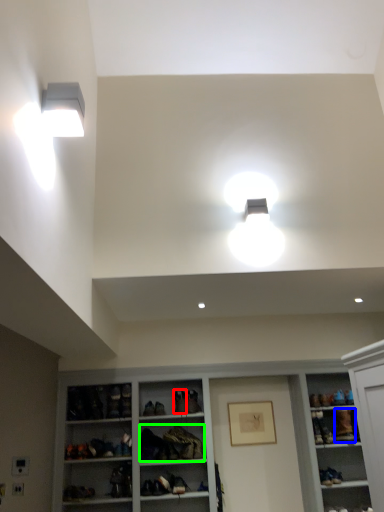
Question: Considering the real-world distances, which object is farthest from shoe (highlighted by a red box)? shoe (highlighted by a blue box) or clothing (highlighted by a green box)?

Choices:
 (A) shoe
 (B) clothing

Answer: (A)